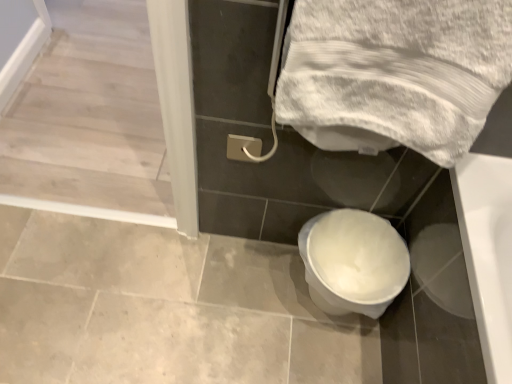
Question: Is point (138, 36) closer or farther from the camera than point (361, 231)?

Choices:
 (A) farther
 (B) closer

Answer: (A)

Question: From the image's perspective, is white glossy screen door at upper left positioned above or below white glossy toilet at lower center?

Choices:
 (A) above
 (B) below

Answer: (A)

Question: Estimate the real-world distances between objects in this image. Which object is closer to the white glossy screen door at upper left?

Choices:
 (A) white textured towel at upper right
 (B) white glossy toilet at lower center

Answer: (A)

Question: Based on their relative distances, which object is farther from the white glossy screen door at upper left?

Choices:
 (A) white textured towel at upper right
 (B) white glossy toilet at lower center

Answer: (B)